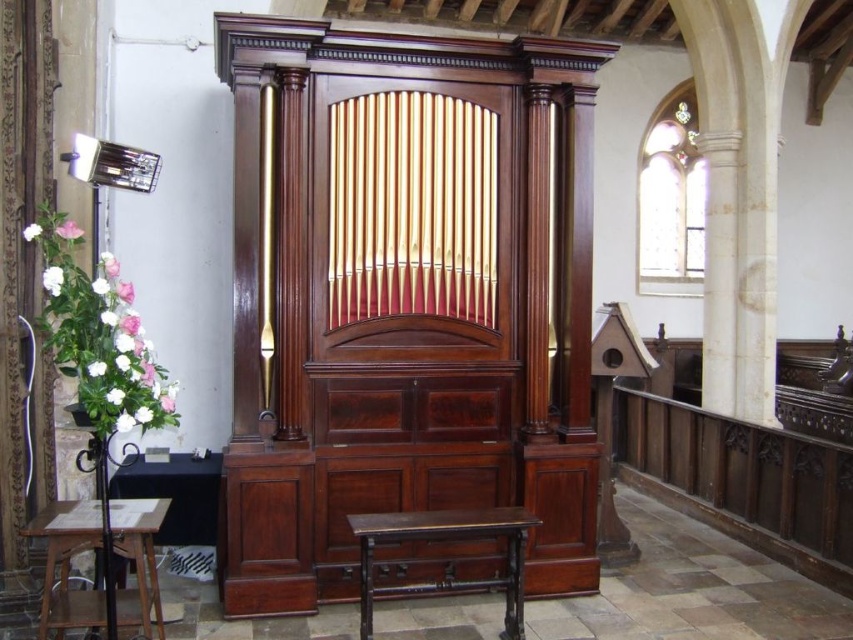
Which is more to the right, mahogany wood organ at center or wooden stool at lower left?

Positioned to the right is mahogany wood organ at center.

Between mahogany wood organ at center and wooden stool at lower left, which one has more height?

Standing taller between the two is mahogany wood organ at center.

Describe the element at coordinates (405, 298) in the screenshot. I see `mahogany wood organ at center` at that location.

At what (x,y) coordinates should I click in order to perform the action: click on mahogany wood organ at center. Please return your answer as a coordinate pair (x, y). Image resolution: width=853 pixels, height=640 pixels. Looking at the image, I should click on (405, 298).

Who is positioned more to the right, dark brown wooden stool at center or wooden stool at lower left?

Positioned to the right is dark brown wooden stool at center.

What do you see at coordinates (444, 540) in the screenshot?
I see `dark brown wooden stool at center` at bounding box center [444, 540].

Locate an element on the screen. dark brown wooden stool at center is located at coordinates (444, 540).

From the picture: Can you confirm if mahogany wood organ at center is positioned above dark brown wooden stool at center?

Indeed, mahogany wood organ at center is positioned over dark brown wooden stool at center.

Is mahogany wood organ at center positioned behind dark brown wooden stool at center?

That is True.

Does point (254, 144) come in front of point (384, 524)?

No, (254, 144) is behind (384, 524).

Where is `mahogany wood organ at center`? The image size is (853, 640). mahogany wood organ at center is located at coordinates (405, 298).